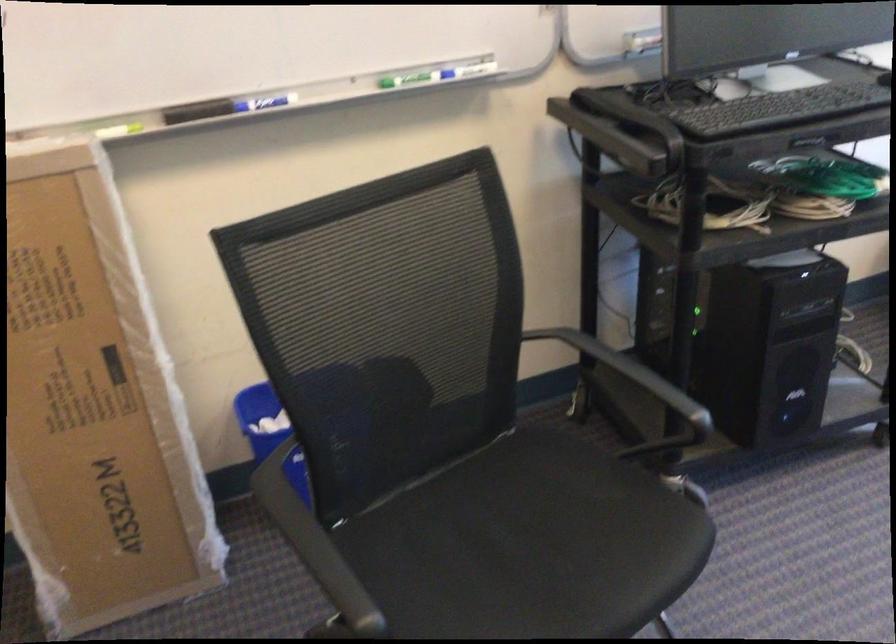
The location [196,111] corresponds to which object?

This point indicates the black whiteboard eraser.